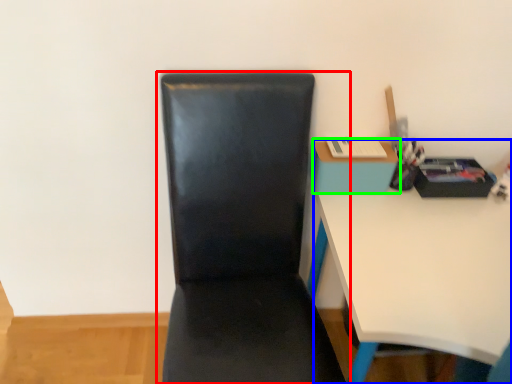
Question: Which object is the closest to the chair (highlighted by a red box)? Choose among these: desk (highlighted by a blue box) or table (highlighted by a green box).

Choices:
 (A) desk
 (B) table

Answer: (A)